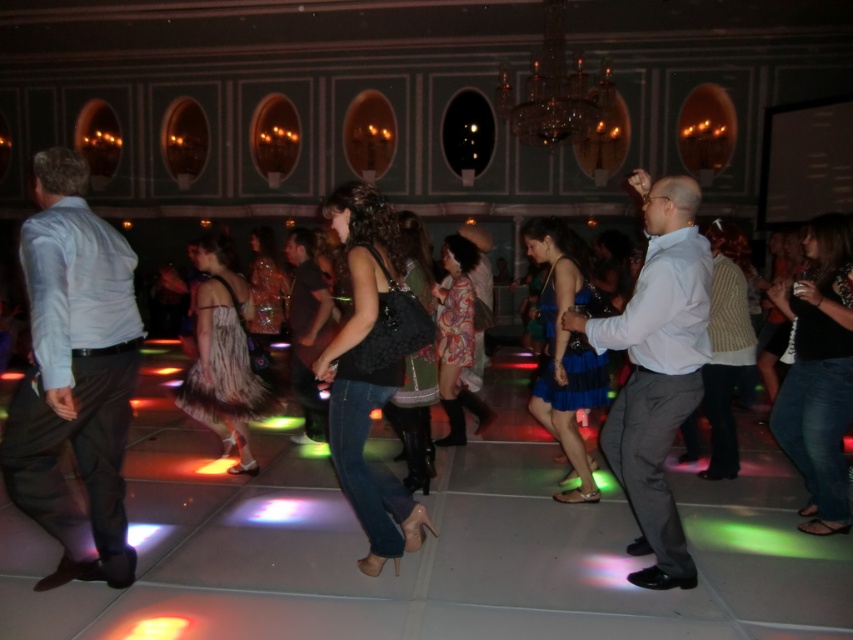
You are a photographer at the event and want to capture both the light blue shirt at left and the light gray fabric shirt at center in a single shot. Based on their positions, which shirt should you focus on first to ensure both are in frame?

You should focus on the light gray fabric shirt at center first because the light blue shirt at left is to the left of it, so by centering the light gray fabric shirt at center, the light blue shirt at left will naturally be included in the frame.